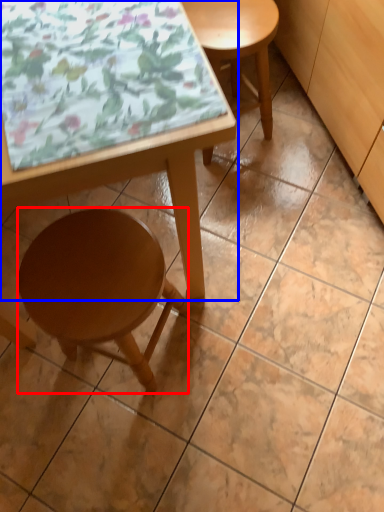
Question: Among these objects, which one is nearest to the camera, stool (highlighted by a red box) or table (highlighted by a blue box)?

Choices:
 (A) stool
 (B) table

Answer: (B)